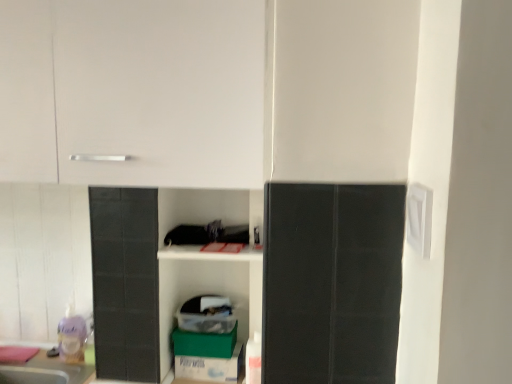
What is the approximate width of green cardboard box at lower center, arranged as the second cardboard box when ordered from the bottom?

It is 7.33 centimeters.

This screenshot has height=384, width=512. I want to click on green cardboard box at lower center, the first cardboard box when ordered from top to bottom, so click(x=204, y=343).

Which object is closer to the camera taking this photo, translucent plastic toy at lower left or white matte cabinet at upper left?

white matte cabinet at upper left is closer to the camera.

Who is taller, translucent plastic toy at lower left or white matte cabinet at upper left?

white matte cabinet at upper left.

From the image's perspective, which is below, translucent plastic toy at lower left or white matte cabinet at upper left?

translucent plastic toy at lower left.

From a real-world perspective, is white matte cabinet at upper left below translucent plastic toy at lower left?

No, from a real-world perspective, white matte cabinet at upper left is not beneath translucent plastic toy at lower left.

Considering the relative sizes of white matte cabinet at upper left and translucent plastic toy at lower left in the image provided, is white matte cabinet at upper left taller than translucent plastic toy at lower left?

Yes, white matte cabinet at upper left is taller than translucent plastic toy at lower left.

This screenshot has width=512, height=384. Find the location of `cabinetry above the translucent plastic toy at lower left (from the image's perspective)`. cabinetry above the translucent plastic toy at lower left (from the image's perspective) is located at coordinates (133, 92).

Looking at this image, considering the positions of objects white matte cabinet at upper left and translucent plastic toy at lower left in the image provided, who is more to the right, white matte cabinet at upper left or translucent plastic toy at lower left?

white matte cabinet at upper left.

Is green cardboard box at lower center, positioned as the first cardboard box in bottom-to-top order, oriented towards green cardboard box at lower center, the first cardboard box when ordered from top to bottom?

No, green cardboard box at lower center, positioned as the first cardboard box in bottom-to-top order, does not turn towards green cardboard box at lower center, the first cardboard box when ordered from top to bottom.

From a real-world perspective, is green cardboard box at lower center, positioned as the first cardboard box in bottom-to-top order, physically above green cardboard box at lower center, the first cardboard box when ordered from top to bottom?

No, from a real-world perspective, green cardboard box at lower center, positioned as the first cardboard box in bottom-to-top order, is not above green cardboard box at lower center, the first cardboard box when ordered from top to bottom.

Considering the sizes of objects green cardboard box at lower center, positioned as the first cardboard box in bottom-to-top order, and green cardboard box at lower center, the first cardboard box when ordered from top to bottom, in the image provided, who is wider, green cardboard box at lower center, positioned as the first cardboard box in bottom-to-top order, or green cardboard box at lower center, the first cardboard box when ordered from top to bottom,?

green cardboard box at lower center, positioned as the first cardboard box in bottom-to-top order, is wider.

How many degrees apart are the facing directions of green cardboard box at lower center, the second cardboard box from the top, and green cardboard box at lower center, the first cardboard box when ordered from top to bottom?

green cardboard box at lower center, the second cardboard box from the top, and green cardboard box at lower center, the first cardboard box when ordered from top to bottom, are facing 0.0032 degrees away from each other.

From the image's perspective, is white matte cabinet at upper left positioned above or below green cardboard box at lower center, positioned as the first cardboard box in bottom-to-top order?

From the image's perspective, white matte cabinet at upper left appears above green cardboard box at lower center, positioned as the first cardboard box in bottom-to-top order.

In terms of height, does white matte cabinet at upper left look taller or shorter compared to green cardboard box at lower center, the second cardboard box from the top?

In the image, white matte cabinet at upper left appears to be taller than green cardboard box at lower center, the second cardboard box from the top.

How different are the orientations of white matte cabinet at upper left and green cardboard box at lower center, the second cardboard box from the top, in degrees?

0.155 degrees.

Is white matte cabinet at upper left positioned beyond the bounds of green cardboard box at lower center, the second cardboard box from the top?

Absolutely, white matte cabinet at upper left is external to green cardboard box at lower center, the second cardboard box from the top.

Can you confirm if white matte cabinet at upper left is smaller than green cardboard box at lower center, the first cardboard box when ordered from top to bottom?

No.

From a real-world perspective, is white matte cabinet at upper left physically located above or below green cardboard box at lower center, the first cardboard box when ordered from top to bottom?

white matte cabinet at upper left is above green cardboard box at lower center, the first cardboard box when ordered from top to bottom.

Could green cardboard box at lower center, arranged as the second cardboard box when ordered from the bottom, be considered to be inside white matte cabinet at upper left?

No.

Which object is more forward, white matte cabinet at upper left or green cardboard box at lower center, the first cardboard box when ordered from top to bottom?

white matte cabinet at upper left is in front.

Considering the points (225, 375) and (75, 344), which point is behind, point (225, 375) or point (75, 344)?

The point (75, 344) is behind.

Considering the sizes of green cardboard box at lower center, positioned as the first cardboard box in bottom-to-top order, and translucent plastic toy at lower left in the image, is green cardboard box at lower center, positioned as the first cardboard box in bottom-to-top order, wider or thinner than translucent plastic toy at lower left?

green cardboard box at lower center, positioned as the first cardboard box in bottom-to-top order, is wider than translucent plastic toy at lower left.

Where is `cardboard box lying below the translucent plastic toy at lower left (from the image's perspective)`? The height and width of the screenshot is (384, 512). cardboard box lying below the translucent plastic toy at lower left (from the image's perspective) is located at coordinates (211, 367).

Who is more distant, green cardboard box at lower center, the first cardboard box when ordered from top to bottom, or white matte cabinet at upper left?

green cardboard box at lower center, the first cardboard box when ordered from top to bottom, is further away from the camera.

Considering the positions of points (222, 343) and (129, 139), is point (222, 343) closer to camera compared to point (129, 139)?

No, it is behind (129, 139).

What's the angular difference between green cardboard box at lower center, the first cardboard box when ordered from top to bottom, and white matte cabinet at upper left's facing directions?

The angular difference between green cardboard box at lower center, the first cardboard box when ordered from top to bottom, and white matte cabinet at upper left is 0.156 degrees.

From the image's perspective, which object appears higher, green cardboard box at lower center, the first cardboard box when ordered from top to bottom, or white matte cabinet at upper left?

white matte cabinet at upper left, from the image's perspective.

Find the location of `toy lying below the white matte cabinet at upper left (from the image's perspective)`. toy lying below the white matte cabinet at upper left (from the image's perspective) is located at coordinates (72, 336).

Image resolution: width=512 pixels, height=384 pixels. Identify the location of toy that appears behind the white matte cabinet at upper left. (72, 336).

Estimate the real-world distances between objects in this image. Which object is further from green cardboard box at lower center, positioned as the first cardboard box in bottom-to-top order, translucent plastic toy at lower left or green cardboard box at lower center, arranged as the second cardboard box when ordered from the bottom?

translucent plastic toy at lower left.

When comparing their distances from white matte cabinet at upper left, does translucent plastic toy at lower left or green cardboard box at lower center, the first cardboard box when ordered from top to bottom, seem further?

Based on the image, translucent plastic toy at lower left appears to be further to white matte cabinet at upper left.

From the image, which object appears to be farther from translucent plastic toy at lower left, green cardboard box at lower center, arranged as the second cardboard box when ordered from the bottom, or white matte cabinet at upper left?

Based on the image, white matte cabinet at upper left appears to be further to translucent plastic toy at lower left.

From the image, which object appears to be nearer to green cardboard box at lower center, positioned as the first cardboard box in bottom-to-top order, translucent plastic toy at lower left or white matte cabinet at upper left?

translucent plastic toy at lower left is closer to green cardboard box at lower center, positioned as the first cardboard box in bottom-to-top order.

Considering their positions, is green cardboard box at lower center, the first cardboard box when ordered from top to bottom, positioned closer to white matte cabinet at upper left than green cardboard box at lower center, positioned as the first cardboard box in bottom-to-top order?

Based on the image, green cardboard box at lower center, the first cardboard box when ordered from top to bottom, appears to be nearer to white matte cabinet at upper left.

From the image, which object appears to be farther from green cardboard box at lower center, the second cardboard box from the top, white matte cabinet at upper left or green cardboard box at lower center, arranged as the second cardboard box when ordered from the bottom?

A: Based on the image, white matte cabinet at upper left appears to be further to green cardboard box at lower center, the second cardboard box from the top.

Estimate the real-world distances between objects in this image. Which object is closer to white matte cabinet at upper left, green cardboard box at lower center, the second cardboard box from the top, or translucent plastic toy at lower left?

green cardboard box at lower center, the second cardboard box from the top.

Based on their spatial positions, is green cardboard box at lower center, the second cardboard box from the top, or white matte cabinet at upper left closer to green cardboard box at lower center, arranged as the second cardboard box when ordered from the bottom?

green cardboard box at lower center, the second cardboard box from the top.

Locate an element on the screen. cardboard box between white matte cabinet at upper left and green cardboard box at lower center, positioned as the first cardboard box in bottom-to-top order, in the up-down direction is located at coordinates (204, 343).

Identify the location of cardboard box between white matte cabinet at upper left and translucent plastic toy at lower left in the up-down direction. The width and height of the screenshot is (512, 384). (204, 343).

The image size is (512, 384). What are the coordinates of `cardboard box between translucent plastic toy at lower left and green cardboard box at lower center, the second cardboard box from the top, in the horizontal direction` in the screenshot? It's located at (204, 343).

Where is `toy between white matte cabinet at upper left and green cardboard box at lower center, the second cardboard box from the top, vertically`? Image resolution: width=512 pixels, height=384 pixels. toy between white matte cabinet at upper left and green cardboard box at lower center, the second cardboard box from the top, vertically is located at coordinates (72, 336).